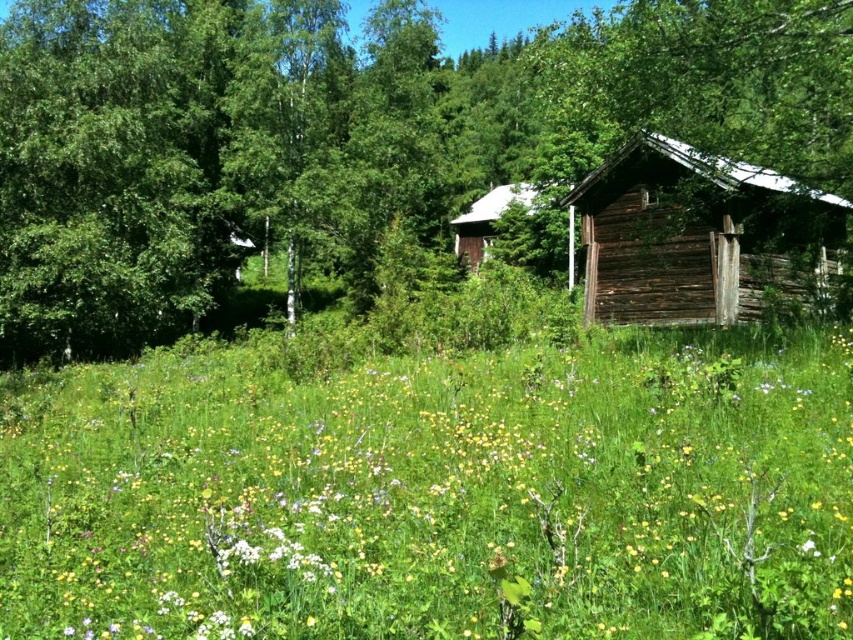
You are standing in the meadow and want to walk to the weathered wood cabin at right. Which direction should you head relative to the green wood tree at center?

You should head to the left relative to the green wood tree at center because the weathered wood cabin at right is to the left of the green wood tree at center.

You are planning to build a small garden shed between the green wood tree at center and the wooden cabin at center. Based on the scene, which object should you place the shed closer to in order to ensure it doesn

The green wood tree at center might be wider than the wooden cabin at center, so placing the shed closer to the wooden cabin at center would provide more space to accommodate the tree

You are a painter standing in the meadow and want to paint both the yellow matte flower at center and the weathered wood cabin at right. Since you have limited canvas space, you need to decide which object to paint larger. Based on their actual sizes, which one should you depict as bigger?

The yellow matte flower at center has a larger size compared to the weathered wood cabin at right, so you should depict the yellow matte flower at center as bigger on the canvas.